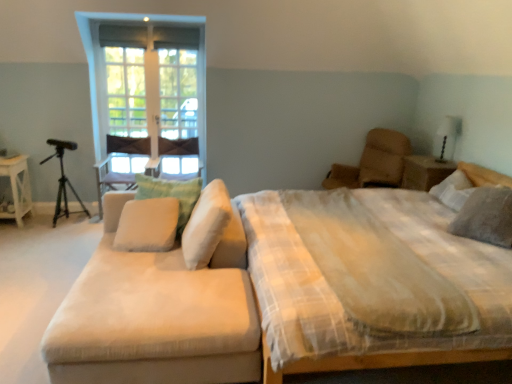
Question: Considering the relative sizes of clear glass door at upper center and beige fabric couch at left in the image provided, is clear glass door at upper center smaller than beige fabric couch at left?

Choices:
 (A) yes
 (B) no

Answer: (A)

Question: From a real-world perspective, is clear glass door at upper center under beige fabric couch at left?

Choices:
 (A) yes
 (B) no

Answer: (B)

Question: Is clear glass door at upper center not inside beige fabric couch at left?

Choices:
 (A) yes
 (B) no

Answer: (A)

Question: Does clear glass door at upper center have a greater width compared to beige fabric couch at left?

Choices:
 (A) yes
 (B) no

Answer: (B)

Question: Can you confirm if clear glass door at upper center is thinner than beige fabric couch at left?

Choices:
 (A) yes
 (B) no

Answer: (A)

Question: Which is correct: beige fabric pillow at center, which appears as the second pillow when viewed from the right, is inside gray textured pillow at right, arranged as the 4th pillow when viewed from the left, or outside of it?

Choices:
 (A) inside
 (B) outside

Answer: (B)

Question: Considering the positions of beige fabric pillow at center, which appears as the second pillow when viewed from the right, and gray textured pillow at right, the first pillow in the right-to-left sequence, in the image, is beige fabric pillow at center, which appears as the second pillow when viewed from the right, wider or thinner than gray textured pillow at right, the first pillow in the right-to-left sequence,?

Choices:
 (A) thin
 (B) wide

Answer: (B)

Question: Considering the positions of beige fabric pillow at center, which appears as the second pillow when viewed from the right, and gray textured pillow at right, arranged as the 4th pillow when viewed from the left, in the image, is beige fabric pillow at center, which appears as the second pillow when viewed from the right, taller or shorter than gray textured pillow at right, arranged as the 4th pillow when viewed from the left,?

Choices:
 (A) tall
 (B) short

Answer: (A)

Question: From a real-world perspective, relative to gray textured pillow at right, the first pillow in the right-to-left sequence, is beige fabric pillow at center, which appears as the second pillow when viewed from the right, vertically above or below?

Choices:
 (A) above
 (B) below

Answer: (B)

Question: Considering the positions of beige fabric pillow at center, the third pillow viewed from the left, and beige fabric pillow at center, arranged as the first pillow when viewed from the left, in the image, is beige fabric pillow at center, the third pillow viewed from the left, wider or thinner than beige fabric pillow at center, arranged as the first pillow when viewed from the left,?

Choices:
 (A) thin
 (B) wide

Answer: (A)

Question: Is beige fabric pillow at center, the third pillow viewed from the left, taller or shorter than beige fabric pillow at center, arranged as the first pillow when viewed from the left?

Choices:
 (A) short
 (B) tall

Answer: (A)

Question: From a real-world perspective, is beige fabric pillow at center, which appears as the second pillow when viewed from the right, physically located above or below beige fabric pillow at center, arranged as the first pillow when viewed from the left?

Choices:
 (A) above
 (B) below

Answer: (A)

Question: Considering the relative positions of beige fabric pillow at center, the third pillow viewed from the left, and beige fabric pillow at center, arranged as the 4th pillow when viewed from the right, in the image provided, is beige fabric pillow at center, the third pillow viewed from the left, to the left or to the right of beige fabric pillow at center, arranged as the 4th pillow when viewed from the right,?

Choices:
 (A) left
 (B) right

Answer: (B)

Question: In the image, is beige fabric pillow at center, the third pillow viewed from the left, positioned in front of or behind white glossy table lamp at upper right?

Choices:
 (A) behind
 (B) front

Answer: (B)

Question: From the image's perspective, is beige fabric pillow at center, which appears as the second pillow when viewed from the right, located above or below white glossy table lamp at upper right?

Choices:
 (A) below
 (B) above

Answer: (A)